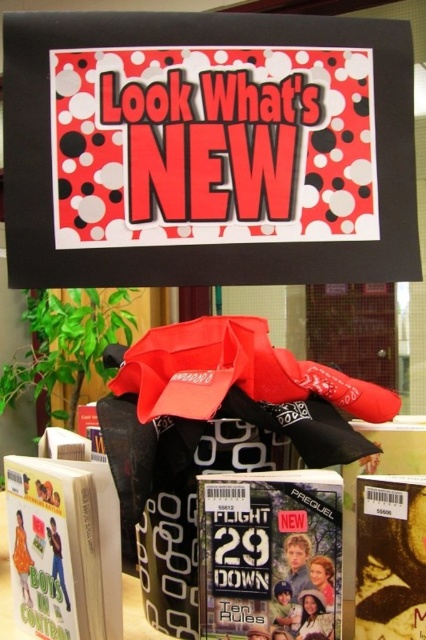
You are organizing a promotional display and need to place a matte paper magazine at center and a matte cardboard magazine at lower left. Based on their sizes, which magazine should you place in a more visible spot to attract attention?

The matte cardboard magazine at lower left is larger in size, so it should be placed in a more visible spot to attract attention.

You are organizing a promotional display and need to place a new matte paper magazine at center and a matte brown magazine at lower right. According to the existing arrangement, which magazine should be placed to the left side of the other?

The matte paper magazine at center should be placed to the left of the matte brown magazine at lower right because the description states that the matte paper magazine at center is to the left of the matte brown magazine at lower right.